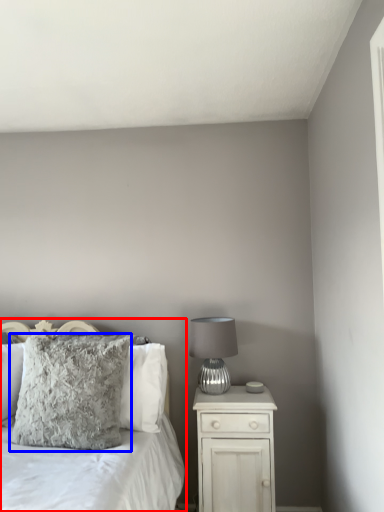
Question: Which of the following is the closest to the observer, bed (highlighted by a red box) or pillow (highlighted by a blue box)?

Choices:
 (A) bed
 (B) pillow

Answer: (A)